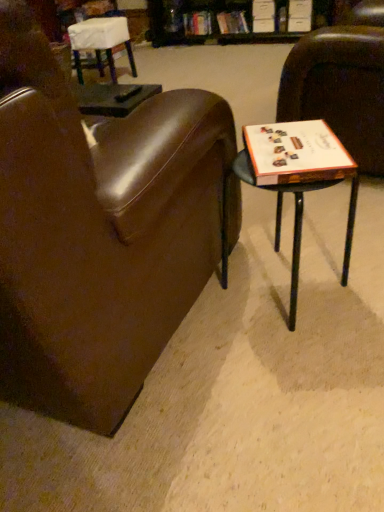
At what (x,y) coordinates should I click in order to perform the action: click on vacant region above white paper at right (from a real-world perspective). Please return your answer as a coordinate pair (x, y). The height and width of the screenshot is (512, 384). Looking at the image, I should click on (292, 145).